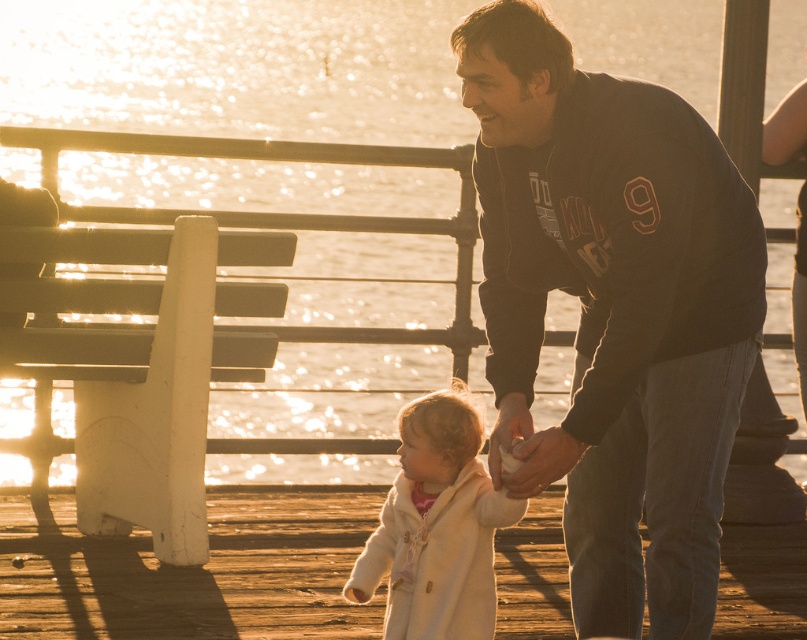
Looking at this image, you are a photographer trying to capture the scene of the dark gray hoodie at center. Where should you position your camera to get the best shot?

The dark gray hoodie at center is located at point 0.487 on the x axis and 0.761 on the y axis, so you should position your camera directly facing that coordinate to capture it best.